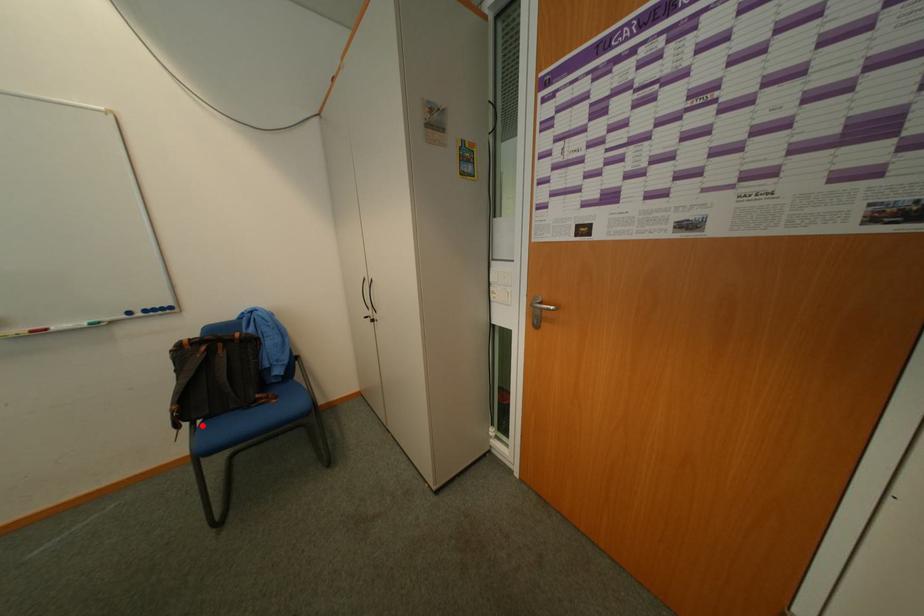
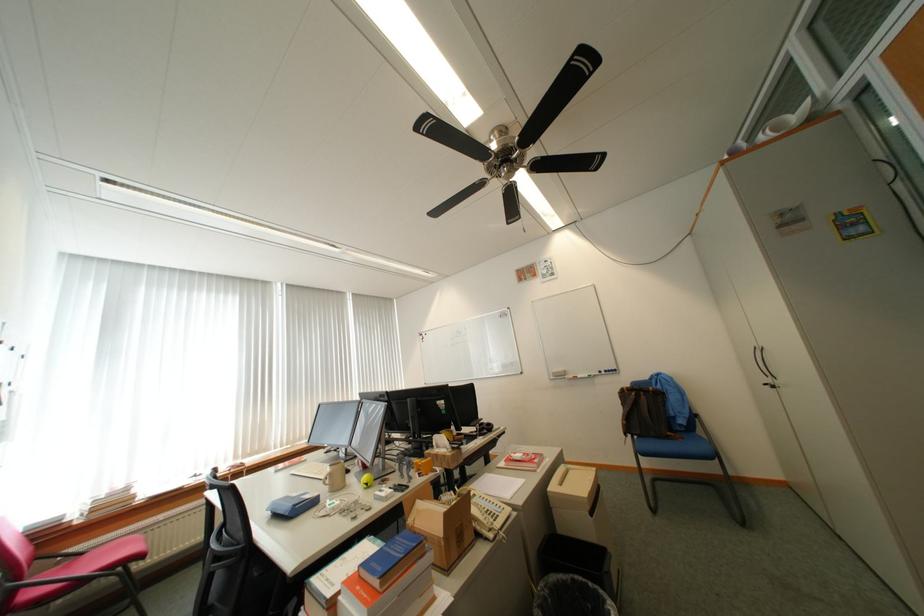
Question: I am providing you with two images of the same scene from different viewpoints. In image1, a red point is highlighted. Considering the same 3D point in image2, which of the following is correct?

Choices:
 (A) It is closer
 (B) It is farther

Answer: (B)